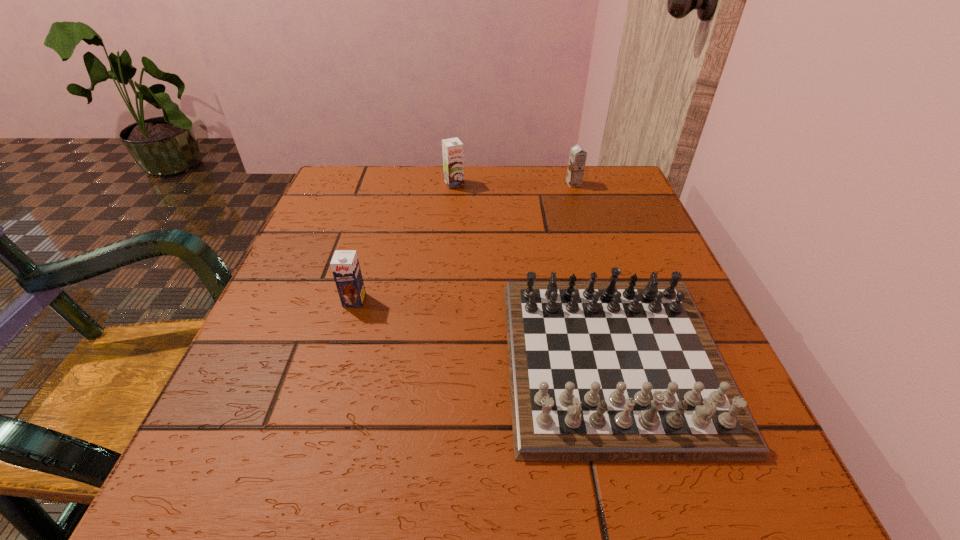
I want to click on chocolate milk present at the right edge, so click(577, 160).

Find the location of `chessboard that is positioned at the right edge`. chessboard that is positioned at the right edge is located at coordinates (614, 370).

Locate an element on the screen. object located at the far right corner is located at coordinates (577, 160).

Locate an element on the screen. This screenshot has height=540, width=960. object that is at the near right corner is located at coordinates (614, 370).

Identify the location of free space at the far edge. This screenshot has width=960, height=540. (524, 194).

At what (x,y) coordinates should I click in order to perform the action: click on free location at the left edge of the desktop. Please return your answer as a coordinate pair (x, y). This screenshot has height=540, width=960. Looking at the image, I should click on (366, 252).

I want to click on blank space at the right edge of the desktop, so click(619, 222).

Locate an element on the screen. The image size is (960, 540). vacant space at the far left corner of the desktop is located at coordinates (377, 218).

Locate an element on the screen. The image size is (960, 540). vacant region between the rightmost chocolate milk and the nearest chocolate milk is located at coordinates (464, 242).

Where is `vacant area that lies between the leftmost chocolate milk and the rightmost chocolate milk`? This screenshot has height=540, width=960. vacant area that lies between the leftmost chocolate milk and the rightmost chocolate milk is located at coordinates (464, 242).